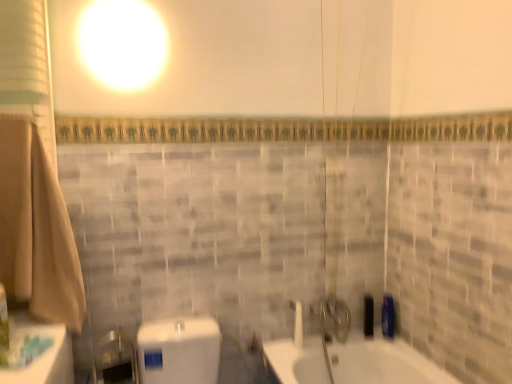
Question: Are green plastic toothbrush at lower left, the 1th toiletry from the front, and beige cotton bath towel at left located far from each other?

Choices:
 (A) yes
 (B) no

Answer: (B)

Question: Considering the relative positions of green plastic toothbrush at lower left, marked as the 3th toiletry in a back-to-front arrangement, and beige cotton bath towel at left in the image provided, is green plastic toothbrush at lower left, marked as the 3th toiletry in a back-to-front arrangement, to the right of beige cotton bath towel at left from the viewer's perspective?

Choices:
 (A) no
 (B) yes

Answer: (A)

Question: Is green plastic toothbrush at lower left, the third toiletry from the right, at the left side of beige cotton bath towel at left?

Choices:
 (A) yes
 (B) no

Answer: (A)

Question: Is beige cotton bath towel at left inside green plastic toothbrush at lower left, marked as the 3th toiletry in a back-to-front arrangement?

Choices:
 (A) yes
 (B) no

Answer: (B)

Question: From the image's perspective, would you say green plastic toothbrush at lower left, the third toiletry from the right, is shown under beige cotton bath towel at left?

Choices:
 (A) yes
 (B) no

Answer: (A)

Question: From the image's perspective, is blue glossy bottle at right, which is counted as the 2th toiletry, starting from the front, positioned above or below black matte soap dispenser at right, the third toiletry from the front?

Choices:
 (A) below
 (B) above

Answer: (B)

Question: Is point (386, 327) positioned closer to the camera than point (373, 334)?

Choices:
 (A) farther
 (B) closer

Answer: (B)

Question: From a real-world perspective, relative to black matte soap dispenser at right, the third toiletry from the front, is blue glossy bottle at right, the third toiletry positioned from the left, vertically above or below?

Choices:
 (A) below
 (B) above

Answer: (B)

Question: Is blue glossy bottle at right, which is counted as the 2th toiletry, starting from the front, bigger or smaller than black matte soap dispenser at right, the second toiletry when ordered from right to left?

Choices:
 (A) big
 (B) small

Answer: (A)

Question: In the image, is beige cotton bath towel at left positioned in front of or behind blue glossy bottle at right, the third toiletry positioned from the left?

Choices:
 (A) behind
 (B) front

Answer: (B)

Question: Does point [80, 276] appear closer or farther from the camera than point [381, 314]?

Choices:
 (A) farther
 (B) closer

Answer: (B)

Question: In the image, is beige cotton bath towel at left on the left side or the right side of blue glossy bottle at right, which is counted as the 2th toiletry, starting from the front?

Choices:
 (A) left
 (B) right

Answer: (A)

Question: In terms of width, does beige cotton bath towel at left look wider or thinner when compared to blue glossy bottle at right, which is counted as the 2th toiletry, starting from the front?

Choices:
 (A) wide
 (B) thin

Answer: (A)

Question: In terms of height, does beige cotton bath towel at left look taller or shorter compared to white glossy shower at center?

Choices:
 (A) tall
 (B) short

Answer: (A)

Question: From the image's perspective, is beige cotton bath towel at left located above or below white glossy shower at center?

Choices:
 (A) above
 (B) below

Answer: (A)